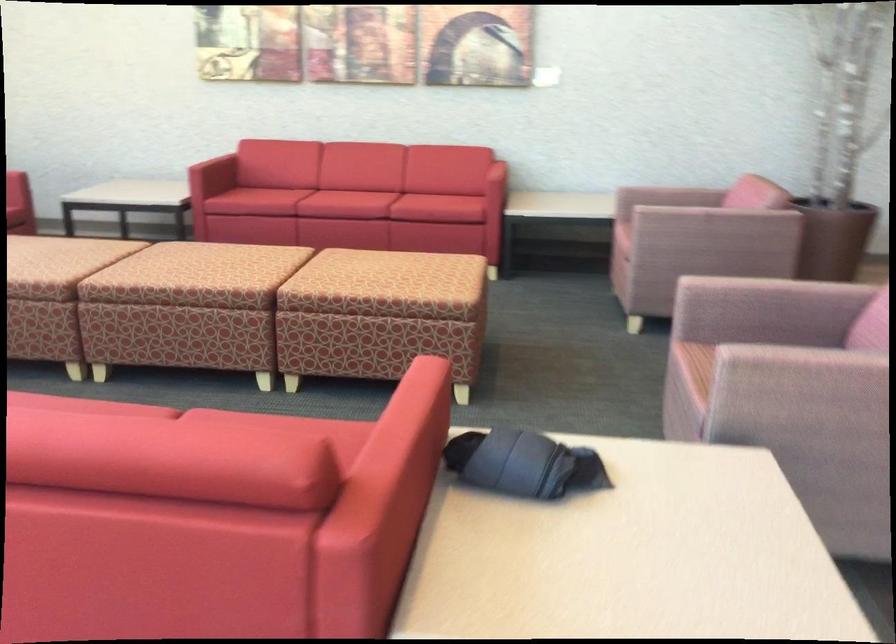
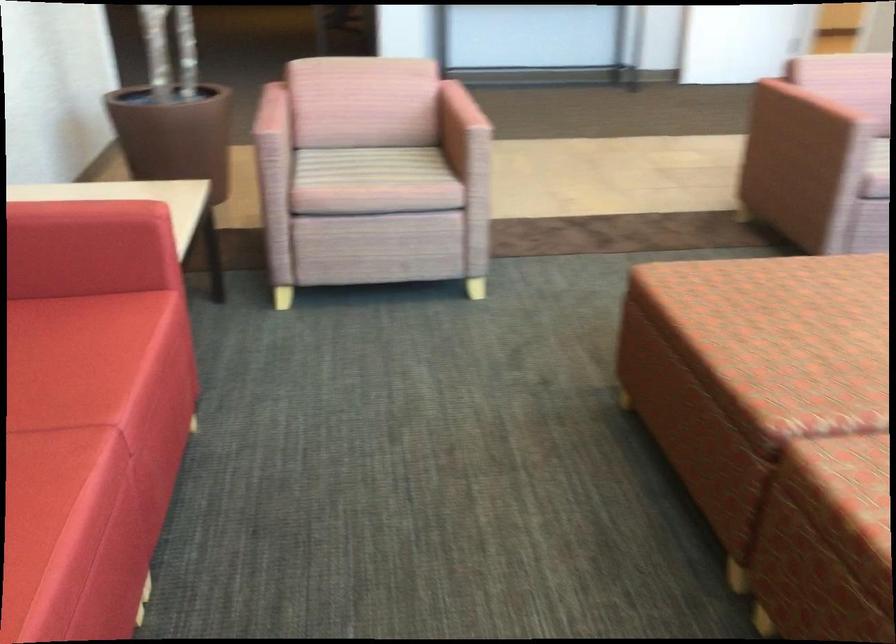
Where in the second image is the point corresponding to (x=784, y=295) from the first image?

(810, 108)